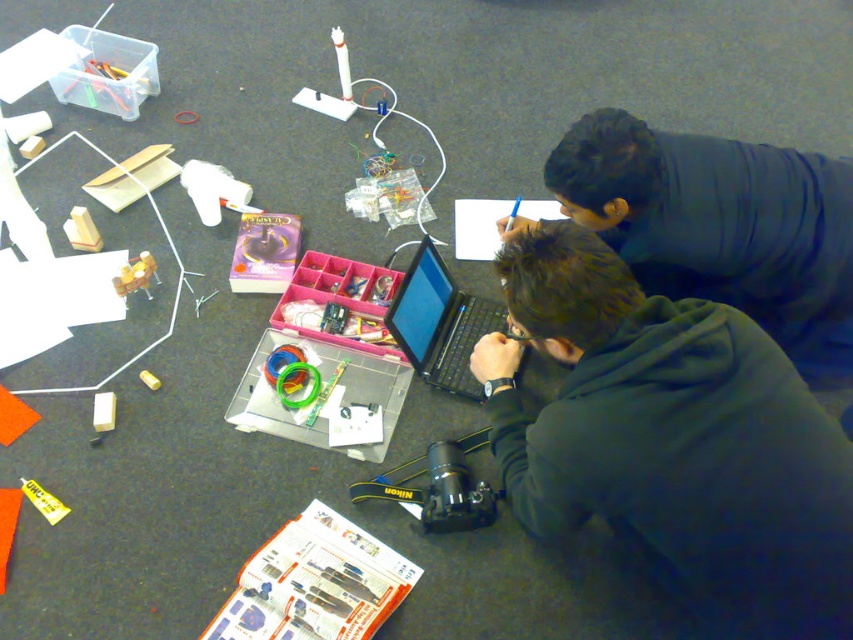
Is dark gray hoodie at center smaller than black matte laptop at center?

Actually, dark gray hoodie at center might be larger than black matte laptop at center.

Is dark gray hoodie at center closer to the viewer compared to black matte laptop at center?

Yes, dark gray hoodie at center is in front of black matte laptop at center.

Is point (611, 317) positioned before point (442, 326)?

Yes, point (611, 317) is closer to viewer.

Locate an element on the screen. dark gray hoodie at center is located at coordinates (672, 438).

Is dark gray hoodie at center taller than dark blue hoodie at upper right?

Correct, dark gray hoodie at center is much taller as dark blue hoodie at upper right.

Between dark gray hoodie at center and dark blue hoodie at upper right, which one appears on the left side from the viewer's perspective?

Positioned to the left is dark gray hoodie at center.

Is point (584, 304) closer to viewer compared to point (567, 204)?

Yes, point (584, 304) is closer to viewer.

This screenshot has width=853, height=640. What are the coordinates of `dark gray hoodie at center` in the screenshot? It's located at (672, 438).

Does point (688, 163) lie in front of point (434, 275)?

Yes, point (688, 163) is in front of point (434, 275).

Does point (648, 168) lie behind point (450, 332)?

That is False.

The width and height of the screenshot is (853, 640). I want to click on dark blue hoodie at upper right, so [x=721, y=227].

Find the location of a particular element. dark blue hoodie at upper right is located at coordinates (721, 227).